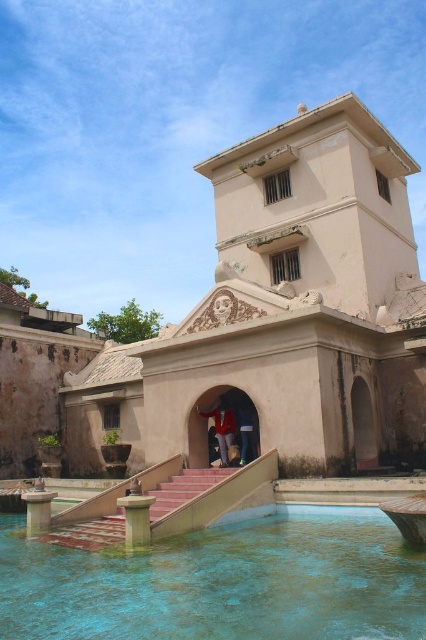
Does blue glossy water at bottom have a greater height compared to red velvet coat at center?

Yes.

Identify the location of blue glossy water at bottom. (221, 582).

I want to click on blue glossy water at bottom, so click(x=221, y=582).

Where is `blue glossy water at bottom`? This screenshot has height=640, width=426. blue glossy water at bottom is located at coordinates (221, 582).

Between point (52, 611) and point (238, 412), which one is positioned behind?

The point (238, 412) is behind.

Measure the distance between blue glossy water at bottom and dark blue jeans at center.

They are 19.93 meters apart.

Measure the distance between point (x=296, y=550) and camera.

35.73 meters

This screenshot has height=640, width=426. Find the location of `blue glossy water at bottom`. blue glossy water at bottom is located at coordinates (221, 582).

Is point (230, 420) positioned after point (247, 419)?

No.

Who is more forward, (230, 417) or (239, 420)?

Positioned in front is point (230, 417).

Identify the location of red velvet coat at center. The width and height of the screenshot is (426, 640). (221, 428).